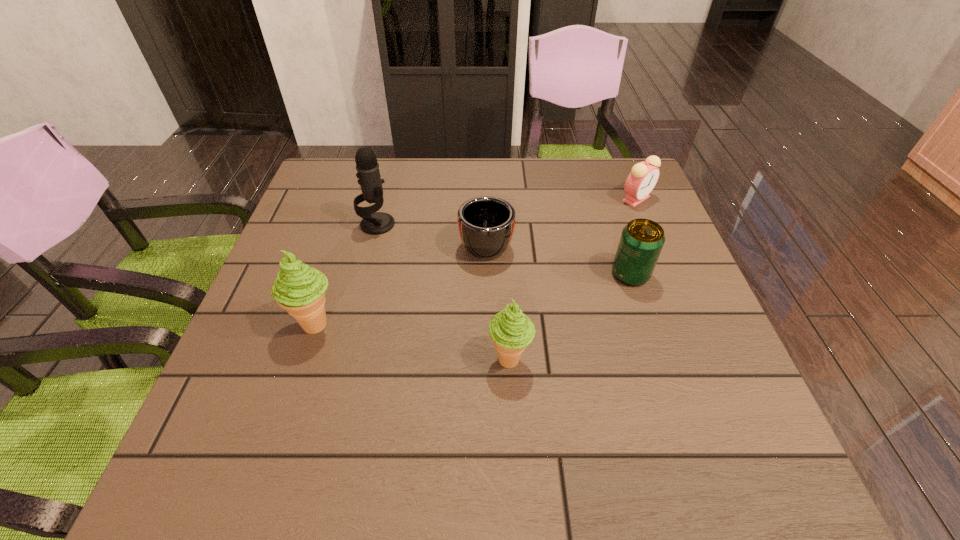
This screenshot has width=960, height=540. In order to click on free space located on the side of the mug with the handle in this screenshot , I will do `click(486, 193)`.

You are a GUI agent. You are given a task and a screenshot of the screen. Output one action in this format:
    pyautogui.click(x=<x>, y=<y>)
    Task: Click on the vacant space situated 0.210m on the side of the mug with the handle
    
    Given the screenshot: What is the action you would take?
    pyautogui.click(x=485, y=173)

This screenshot has height=540, width=960. Identify the location of free space located 0.160m on the back of the microphone. (389, 179).

At what (x,y) coordinates should I click in order to perform the action: click on vacant space located 0.150m on the face of the alarm clock. Please return your answer as a coordinate pair (x, y). The width and height of the screenshot is (960, 540). Looking at the image, I should click on (657, 246).

Where is `vacant space situated on the back of the beer can`? vacant space situated on the back of the beer can is located at coordinates (613, 223).

The width and height of the screenshot is (960, 540). I want to click on object situated at the far edge, so click(x=643, y=177).

Where is `object that is at the near edge`? This screenshot has width=960, height=540. object that is at the near edge is located at coordinates (510, 330).

Find the location of a particular element. The height and width of the screenshot is (540, 960). object at the left edge is located at coordinates (299, 289).

Locate an element on the screen. alarm clock located in the right edge section of the desktop is located at coordinates (643, 177).

At what (x,y) coordinates should I click in order to perform the action: click on beer can that is at the right edge. Please return your answer as a coordinate pair (x, y). The width and height of the screenshot is (960, 540). Looking at the image, I should click on (641, 241).